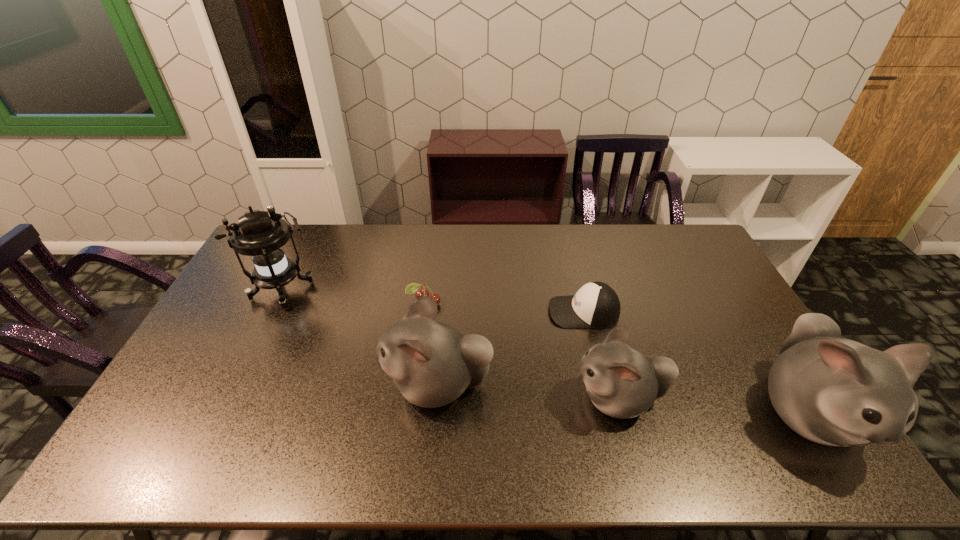
This screenshot has height=540, width=960. What are the coordinates of `object positioned at the right edge` in the screenshot? It's located at (834, 391).

Where is `object present at the near right corner`? Image resolution: width=960 pixels, height=540 pixels. object present at the near right corner is located at coordinates (834, 391).

This screenshot has width=960, height=540. In the image, there is a desktop. What are the coordinates of `vacant space at the far edge` in the screenshot? It's located at (632, 244).

The image size is (960, 540). In order to click on vacant space at the near edge of the desktop in this screenshot , I will do `click(560, 422)`.

Where is `vacant point at the left edge`? vacant point at the left edge is located at coordinates (236, 307).

Where is `free space between the cherry and the cap`? This screenshot has width=960, height=540. free space between the cherry and the cap is located at coordinates (504, 308).

Find the location of `vacant area that lies between the cap and the leftmost hamster`. vacant area that lies between the cap and the leftmost hamster is located at coordinates (511, 348).

I want to click on vacant space in between the third tallest object and the fourth tallest object, so click(528, 392).

What are the coordinates of `free space that is in between the leftmost object and the rightmost object` in the screenshot? It's located at (545, 352).

The width and height of the screenshot is (960, 540). Identify the location of empty space that is in between the lantern and the cherry. (353, 298).